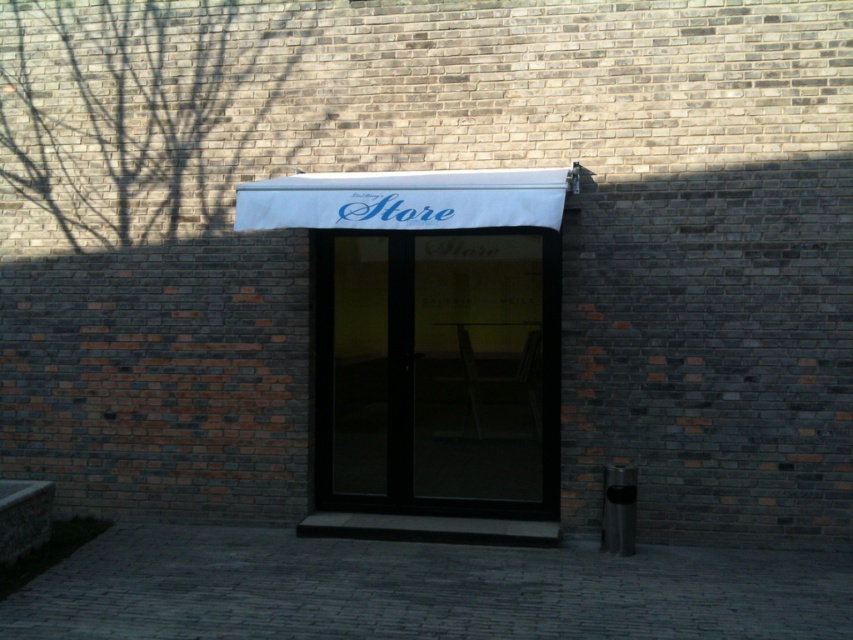
Is point (352, 449) positioned after point (276, 216)?

Yes.

Does transparent glass door at center lie behind white fabric store sign at center?

Yes, it is.

Is point (318, 371) farther from camera compared to point (381, 189)?

That is True.

At what (x,y) coordinates should I click in order to perform the action: click on transparent glass door at center. Please return your answer as a coordinate pair (x, y). This screenshot has width=853, height=640. Looking at the image, I should click on (437, 371).